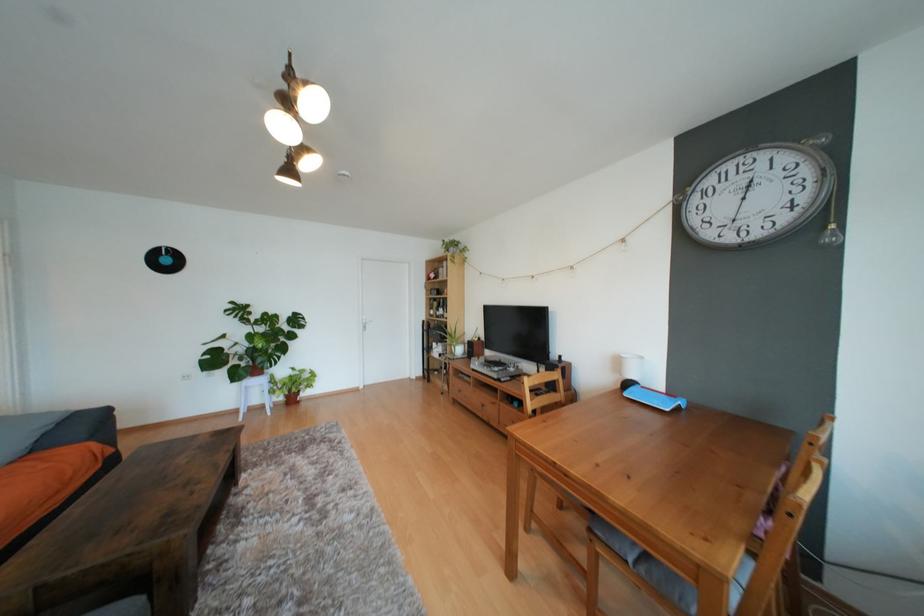
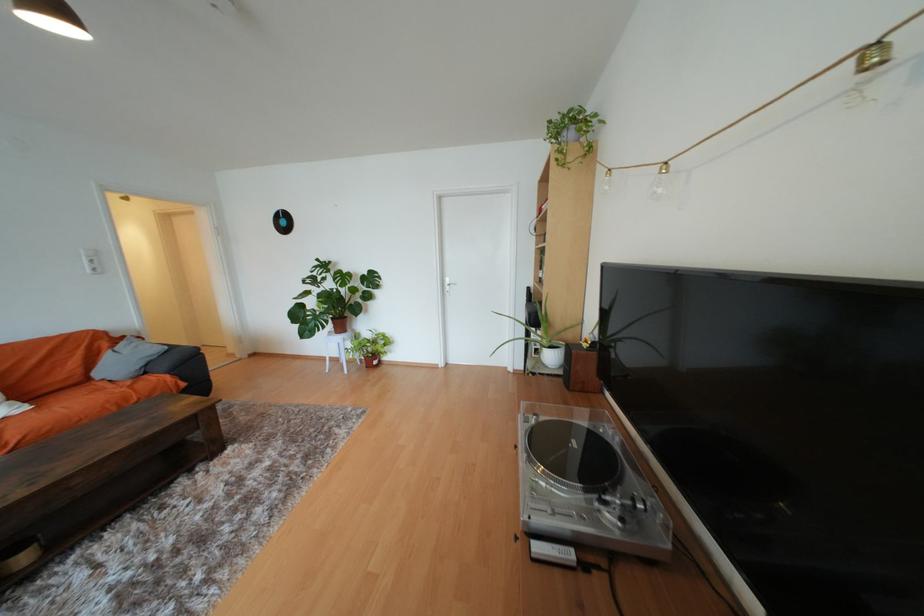
Where in the second image is the point corresponding to point (318, 373) from the first image?

(391, 339)